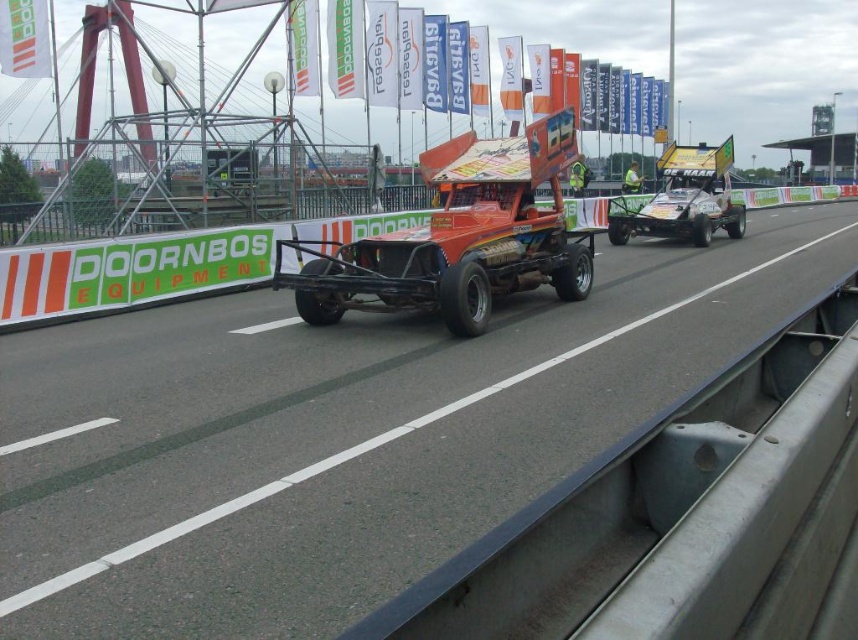
Question: Is smooth asphalt road at center bigger than yellow metallic race car at center?

Choices:
 (A) no
 (B) yes

Answer: (B)

Question: Which of the following is the farthest from the observer?

Choices:
 (A) smooth asphalt road at center
 (B) yellow metallic race car at center

Answer: (B)

Question: Estimate the real-world distances between objects in this image. Which object is closer to the smooth asphalt road at center?

Choices:
 (A) orange matte race car at center
 (B) yellow metallic race car at center

Answer: (A)

Question: Does smooth asphalt road at center have a lesser width compared to orange matte race car at center?

Choices:
 (A) yes
 (B) no

Answer: (B)

Question: Is smooth asphalt road at center behind orange matte race car at center?

Choices:
 (A) yes
 (B) no

Answer: (B)

Question: Which of the following is the farthest from the observer?

Choices:
 (A) tap(524, 195)
 (B) tap(696, 179)

Answer: (B)